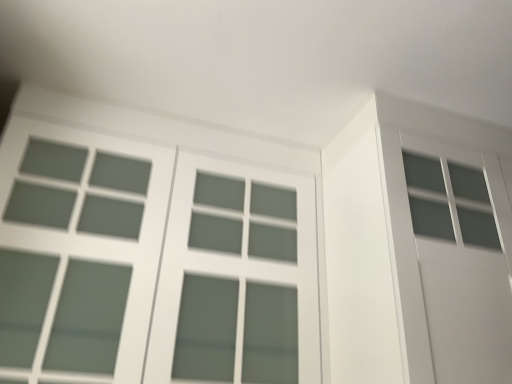
Image resolution: width=512 pixels, height=384 pixels. Describe the element at coordinates (151, 264) in the screenshot. I see `satin white window at upper left` at that location.

You are a GUI agent. You are given a task and a screenshot of the screen. Output one action in this format:
    pyautogui.click(x=<x>, y=<y>)
    Task: Click on the satin white window at upper left
    The width and height of the screenshot is (512, 384).
    Given the screenshot: What is the action you would take?
    [151, 264]

What do you see at coordinates (460, 263) in the screenshot? The height and width of the screenshot is (384, 512). I see `satin white screen door at upper right` at bounding box center [460, 263].

The height and width of the screenshot is (384, 512). I want to click on satin white screen door at upper right, so click(460, 263).

This screenshot has height=384, width=512. In order to click on satin white window at upper left in this screenshot , I will do `click(151, 264)`.

Can you confirm if satin white screen door at upper right is positioned to the left of satin white window at upper left?

No.

In the scene shown: Is satin white screen door at upper right positioned in front of satin white window at upper left?

No, satin white screen door at upper right is further to the viewer.

Is point (431, 146) closer or farther from the camera than point (51, 283)?

Point (431, 146) appears to be farther away from the viewer than point (51, 283).

From the image's perspective, relative to satin white window at upper left, is satin white screen door at upper right above or below?

From the image's perspective, satin white screen door at upper right appears below satin white window at upper left.

From a real-world perspective, is satin white screen door at upper right above or below satin white window at upper left?

satin white screen door at upper right is above satin white window at upper left.

Considering the sizes of satin white screen door at upper right and satin white window at upper left in the image, is satin white screen door at upper right wider or thinner than satin white window at upper left?

Considering their sizes, satin white screen door at upper right looks slimmer than satin white window at upper left.

Which of these two, satin white screen door at upper right or satin white window at upper left, stands taller?

Standing taller between the two is satin white window at upper left.

In the scene shown: Looking at the image, does satin white screen door at upper right seem bigger or smaller compared to satin white window at upper left?

Considering their sizes, satin white screen door at upper right takes up less space than satin white window at upper left.

Can we say satin white screen door at upper right lies outside satin white window at upper left?

Yes.

Is satin white screen door at upper right placed right next to satin white window at upper left?

No, satin white screen door at upper right is not with satin white window at upper left.

Could you tell me if satin white screen door at upper right is facing satin white window at upper left?

No.

Where is `window below the satin white screen door at upper right (from a real-world perspective)`? window below the satin white screen door at upper right (from a real-world perspective) is located at coordinates (151, 264).

Based on their positions, is satin white window at upper left located to the left or right of satin white screen door at upper right?

Based on their positions, satin white window at upper left is located to the left of satin white screen door at upper right.

Considering the positions of objects satin white window at upper left and satin white screen door at upper right in the image provided, who is in front, satin white window at upper left or satin white screen door at upper right?

satin white window at upper left is in front.

Is point (216, 376) in front of point (408, 173)?

That is True.

From the image's perspective, is satin white window at upper left above or below satin white screen door at upper right?

From the image's perspective, satin white window at upper left appears above satin white screen door at upper right.

Looking at this image, from a real-world perspective, which is physically above, satin white window at upper left or satin white screen door at upper right?

In real-world perspective, satin white screen door at upper right is above.

Is satin white window at upper left wider or thinner than satin white screen door at upper right?

In the image, satin white window at upper left appears to be wider than satin white screen door at upper right.

Who is taller, satin white window at upper left or satin white screen door at upper right?

With more height is satin white window at upper left.

Does satin white window at upper left have a larger size compared to satin white screen door at upper right?

Correct, satin white window at upper left is larger in size than satin white screen door at upper right.

Is satin white window at upper left located outside satin white screen door at upper right?

satin white window at upper left lies outside satin white screen door at upper right's area.

Are satin white window at upper left and satin white screen door at upper right making contact?

satin white window at upper left and satin white screen door at upper right are not in contact.

Is satin white window at upper left positioned with its back to satin white screen door at upper right?

No, satin white window at upper left is not facing away from satin white screen door at upper right.

How different are the orientations of satin white window at upper left and satin white screen door at upper right in degrees?

There is a 6.59e-05-degree angle between the facing directions of satin white window at upper left and satin white screen door at upper right.

How distant is satin white window at upper left from satin white screen door at upper right?

satin white window at upper left is 24.20 inches from satin white screen door at upper right.

This screenshot has height=384, width=512. Find the location of `window in front of the satin white screen door at upper right`. window in front of the satin white screen door at upper right is located at coordinates pos(151,264).

Where is `screen door below the satin white window at upper left (from the image's perspective)`? screen door below the satin white window at upper left (from the image's perspective) is located at coordinates (460, 263).

Identify the location of window on the left of the satin white screen door at upper right. Image resolution: width=512 pixels, height=384 pixels. (151, 264).